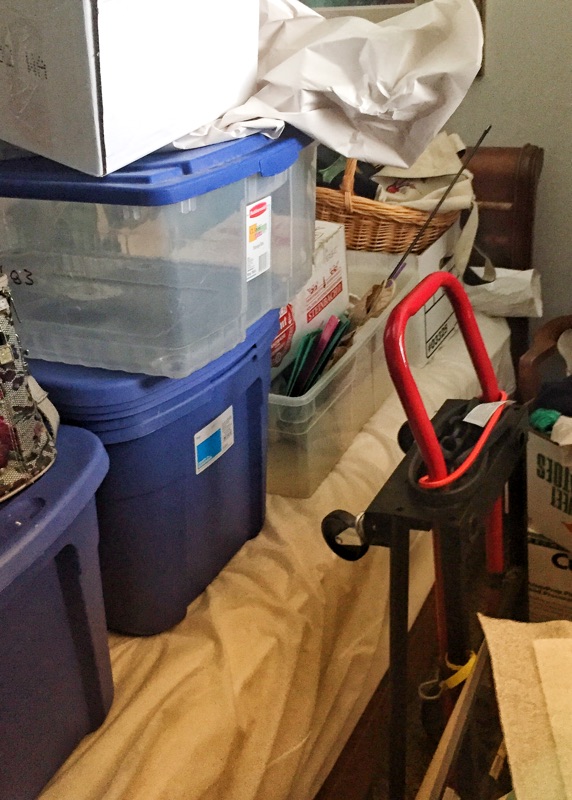
Identify the location of cardboard boxes. The width and height of the screenshot is (572, 800). (168, 62), (325, 272), (431, 250), (536, 484), (540, 552).